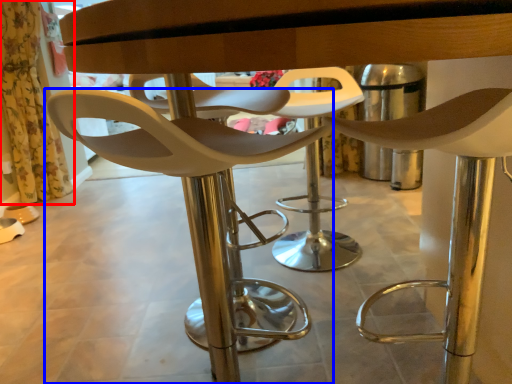
Question: Among these objects, which one is farthest to the camera, curtain (highlighted by a red box) or chair (highlighted by a blue box)?

Choices:
 (A) curtain
 (B) chair

Answer: (A)